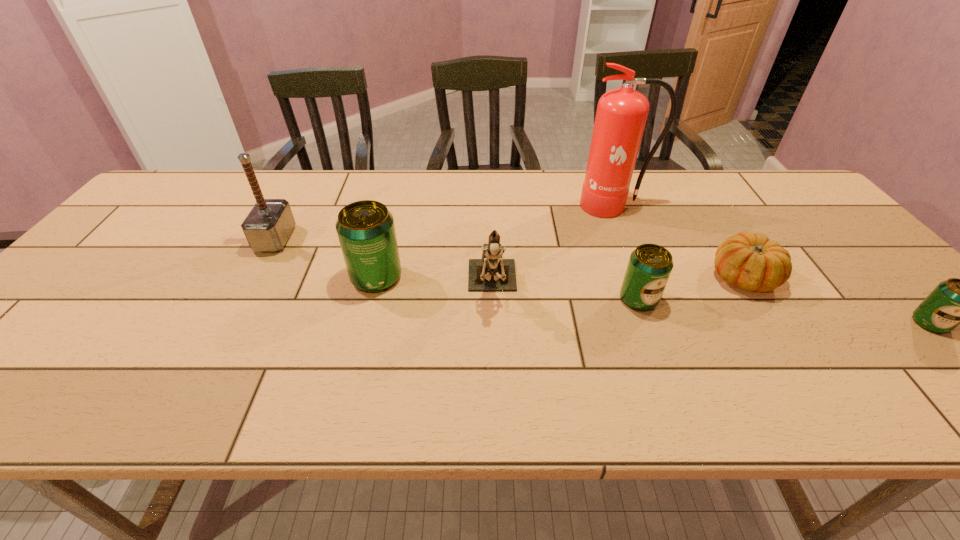
Identify the location of free space between the second object from right to left and the fourth shortest object. The width and height of the screenshot is (960, 540). (560, 277).

Find the location of a particular element. The image size is (960, 540). empty space between the leftmost object and the fourth shortest object is located at coordinates (325, 258).

At what (x,y) coordinates should I click in order to perform the action: click on vacant region between the rightmost object and the sixth object from left to right. Please return your answer as a coordinate pair (x, y). The image size is (960, 540). Looking at the image, I should click on (836, 300).

Locate an element on the screen. This screenshot has height=540, width=960. vacant space that is in between the gourd and the fifth tallest object is located at coordinates (691, 288).

Point out which object is positioned as the fourth nearest to the figurine. Please provide its 2D coordinates. Your answer should be formatted as a tuple, i.e. [(x, y)], where the tuple contains the x and y coordinates of a point satisfying the conditions above.

[(751, 262)]

Where is `object that is the sixth closest to the second farthest object`? Image resolution: width=960 pixels, height=540 pixels. object that is the sixth closest to the second farthest object is located at coordinates (955, 301).

Select which beer can appears as the closest to the tallest beer can. Please provide its 2D coordinates. Your answer should be formatted as a tuple, i.e. [(x, y)], where the tuple contains the x and y coordinates of a point satisfying the conditions above.

[(650, 265)]

Locate an element on the screen. Image resolution: width=960 pixels, height=540 pixels. beer can that is the third closest to the fifth object from right to left is located at coordinates (955, 301).

This screenshot has height=540, width=960. I want to click on vacant space that satisfies the following two spatial constraints: 1. on the front-facing side of the shortest beer can; 2. on the left side of the third object from left to right, so click(x=493, y=323).

Where is `vacant space that satisfies the following two spatial constraints: 1. on the front side of the leftmost beer can; 2. on the right side of the third shortest object`? The image size is (960, 540). vacant space that satisfies the following two spatial constraints: 1. on the front side of the leftmost beer can; 2. on the right side of the third shortest object is located at coordinates (371, 299).